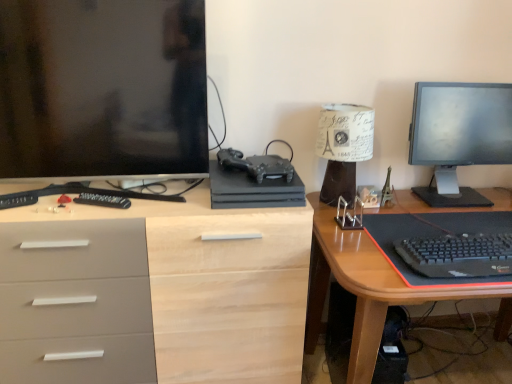
Question: Is black plastic remote control at left, placed as the second remote control when sorted from left to right, situated inside matte black gaming console at center or outside?

Choices:
 (A) inside
 (B) outside

Answer: (B)

Question: From the image's perspective, is black plastic remote control at left, placed as the second remote control when sorted from left to right, above or below matte black gaming console at center?

Choices:
 (A) above
 (B) below

Answer: (B)

Question: Which is farther from the matte black monitor at left?

Choices:
 (A) matte black monitor at upper right
 (B) wooden desk at right, positioned as the 2th desk in left-to-right order
 (C) black plastic computer tower at lower right
 (D) matte wood desk at center, arranged as the second desk when viewed from the right
 (E) black plastic remote control at left, which is counted as the 1th remote control, starting from the right

Answer: (C)

Question: Which object is the farthest from the matte wood desk at center, the first desk viewed from the left?

Choices:
 (A) black matte keyboard at lower right
 (B) matte black gaming console at center
 (C) black plastic computer tower at lower right
 (D) wooden desk at right, positioned as the 2th desk in left-to-right order
 (E) black plastic remote control at left, placed as the second remote control when sorted from left to right

Answer: (A)